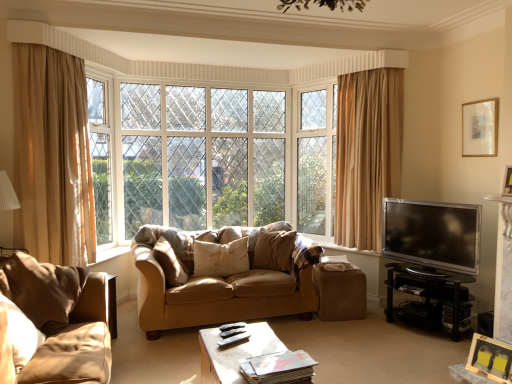
What do you see at coordinates (490, 358) in the screenshot? I see `wooden picture frame at lower right, the first picture frame from the left` at bounding box center [490, 358].

Describe the element at coordinates (340, 293) in the screenshot. I see `brown fabric ottoman at lower center` at that location.

Measure the distance between point (277, 253) and camera.

Point (277, 253) is 4.13 meters away from camera.

The image size is (512, 384). Describe the element at coordinates (220, 258) in the screenshot. I see `beige fabric pillow at center, the 2th pillow viewed from the left` at that location.

The image size is (512, 384). What are the coordinates of `white painted wood window frame at upper left` in the screenshot? It's located at (101, 153).

Locate an element on the screen. The width and height of the screenshot is (512, 384). wooden picture frame at upper right, the 2th picture frame positioned from the bottom is located at coordinates (507, 182).

The width and height of the screenshot is (512, 384). What are the coordinates of `wooden picture frame at lower right, the first picture frame from the left` in the screenshot? It's located at (490, 358).

Is suede couch at center, positioned as the first studio couch in right-to-left order, looking in the opposite direction of white painted wood window frame at upper left?

suede couch at center, positioned as the first studio couch in right-to-left order, is not turned away from white painted wood window frame at upper left.

Which is in front, point (161, 293) or point (108, 123)?

The point (161, 293) is closer.

Between suede couch at center, positioned as the first studio couch in right-to-left order, and white painted wood window frame at upper left, which one is positioned in front?

suede couch at center, positioned as the first studio couch in right-to-left order, is closer to the camera.

From a real-world perspective, is suede couch at center, which appears as the second studio couch when viewed from the front, under white painted wood window frame at upper left?

Yes, from a real-world perspective, suede couch at center, which appears as the second studio couch when viewed from the front, is below white painted wood window frame at upper left.

Can you confirm if white painted wood window frame at upper left is bigger than beige fabric pillow at center, the 2th pillow viewed from the left?

Yes.

Based on the photo, can you confirm if white painted wood window frame at upper left is taller than beige fabric pillow at center, the 2th pillow viewed from the left?

Yes, white painted wood window frame at upper left is taller than beige fabric pillow at center, the 2th pillow viewed from the left.

Do you think white painted wood window frame at upper left is within beige fabric pillow at center, the 2th pillow from the right, or outside of it?

white painted wood window frame at upper left is located beyond the bounds of beige fabric pillow at center, the 2th pillow from the right.

Between white painted wood window frame at upper left and beige fabric pillow at center, the 2th pillow from the right, which one has smaller width?

white painted wood window frame at upper left is thinner.

Is brown fabric ottoman at lower center facing away from suede-like beige sofa at lower left, which appears as the 1th studio couch when viewed from the front?

No, brown fabric ottoman at lower center is not facing away from suede-like beige sofa at lower left, which appears as the 1th studio couch when viewed from the front.

Where is `the 2nd studio couch above when counting from the brown fabric ottoman at lower center (from the image's perspective)`? Image resolution: width=512 pixels, height=384 pixels. the 2nd studio couch above when counting from the brown fabric ottoman at lower center (from the image's perspective) is located at coordinates (x=61, y=320).

Considering the relative sizes of brown fabric ottoman at lower center and suede-like beige sofa at lower left, marked as the second studio couch in a right-to-left arrangement, in the image provided, is brown fabric ottoman at lower center bigger than suede-like beige sofa at lower left, marked as the second studio couch in a right-to-left arrangement,?

No, brown fabric ottoman at lower center is not bigger than suede-like beige sofa at lower left, marked as the second studio couch in a right-to-left arrangement.

Does black glass tv stand at right, which appears as the 2th table when viewed from the left, turn towards wooden coffee table at center, which is counted as the 2th table, starting from the back?

Yes, black glass tv stand at right, which appears as the 2th table when viewed from the left, is aimed at wooden coffee table at center, which is counted as the 2th table, starting from the back.

Considering the relative sizes of black glass tv stand at right, which is the 2th table in front-to-back order, and wooden coffee table at center, arranged as the second table when viewed from the right, in the image provided, is black glass tv stand at right, which is the 2th table in front-to-back order, shorter than wooden coffee table at center, arranged as the second table when viewed from the right,?

In fact, black glass tv stand at right, which is the 2th table in front-to-back order, may be taller than wooden coffee table at center, arranged as the second table when viewed from the right.

Is black glass tv stand at right, the 1th table when ordered from back to front, smaller than wooden coffee table at center, which is counted as the first table, starting from the front?

Actually, black glass tv stand at right, the 1th table when ordered from back to front, might be larger than wooden coffee table at center, which is counted as the first table, starting from the front.

Visually, is black glass tv stand at right, which appears as the 2th table when viewed from the left, positioned to the left or to the right of wooden coffee table at center, arranged as the second table when viewed from the right?

black glass tv stand at right, which appears as the 2th table when viewed from the left, is to the right of wooden coffee table at center, arranged as the second table when viewed from the right.

From the picture: Is wooden picture frame at upper right, which is the 1th picture frame in back-to-front order, a part of wooden picture frame at upper right, which appears as the 2th picture frame when viewed from the right?

No.

From a real-world perspective, which is physically above, wooden picture frame at upper right, the 2th picture frame when ordered from left to right, or wooden picture frame at upper right, marked as the third picture frame in a left-to-right arrangement?

wooden picture frame at upper right, marked as the third picture frame in a left-to-right arrangement, from a real-world perspective.

Is wooden picture frame at upper right, the 2th picture frame when ordered from left to right, taller than wooden picture frame at upper right, marked as the third picture frame in a left-to-right arrangement?

In fact, wooden picture frame at upper right, the 2th picture frame when ordered from left to right, may be shorter than wooden picture frame at upper right, marked as the third picture frame in a left-to-right arrangement.

Does black glass tv stand at right, which is the 2th table in front-to-back order, turn towards wooden picture frame at lower right, the first picture frame from the left?

No, black glass tv stand at right, which is the 2th table in front-to-back order, does not turn towards wooden picture frame at lower right, the first picture frame from the left.

From the image's perspective, would you say black glass tv stand at right, which is the 2th table in front-to-back order, is shown under wooden picture frame at lower right, the first picture frame from the left?

Actually, black glass tv stand at right, which is the 2th table in front-to-back order, appears above wooden picture frame at lower right, the first picture frame from the left, in the image.

What are the coordinates of `the 1st picture frame to the right of the black glass tv stand at right, which is the 1th table from right to left, counting from the anchor's position` in the screenshot? It's located at (490, 358).

Is black glass tv stand at right, which appears as the 2th table when viewed from the left, far from wooden picture frame at lower right, acting as the 3th picture frame starting from the top?

They are positioned close to each other.

Is black glass tv stand at right, the 1th table when ordered from back to front, outside of wooden picture frame at upper right, the 1th picture frame in the right-to-left sequence?

black glass tv stand at right, the 1th table when ordered from back to front, lies outside wooden picture frame at upper right, the 1th picture frame in the right-to-left sequence,'s area.

Locate an element on the screen. the 1st table in front of the wooden picture frame at upper right, which is the third picture frame from bottom to top is located at coordinates 429,289.

Which is more to the right, black glass tv stand at right, which is the 2th table in front-to-back order, or wooden picture frame at upper right, the 1th picture frame in the right-to-left sequence?

wooden picture frame at upper right, the 1th picture frame in the right-to-left sequence, is more to the right.

From a real-world perspective, is black glass tv stand at right, which appears as the 2th table when viewed from the left, physically located above or below wooden picture frame at upper right, marked as the third picture frame in a left-to-right arrangement?

Clearly, from a real-world perspective, black glass tv stand at right, which appears as the 2th table when viewed from the left, is below wooden picture frame at upper right, marked as the third picture frame in a left-to-right arrangement.

At what (x,y) coordinates should I click in order to perform the action: click on window frame on the left of suede couch at center, the 1th studio couch positioned from the back. Please return your answer as a coordinate pair (x, y). This screenshot has width=512, height=384. Looking at the image, I should click on (101, 153).

Identify the location of window frame behind the beige fabric pillow at center, the 2th pillow from the right. This screenshot has height=384, width=512. (101, 153).

From the image, which object appears to be farther from clear glass window at center, beige fabric curtain at left or wooden picture frame at upper right, which is the third picture frame from bottom to top?

wooden picture frame at upper right, which is the third picture frame from bottom to top.

Considering their positions, is wooden coffee table at center, which is counted as the first table, starting from the front, positioned closer to beige fabric curtain at left than white painted wood window frame at upper left?

Among the two, white painted wood window frame at upper left is located nearer to beige fabric curtain at left.

Looking at the image, which one is located further to brown fabric ottoman at lower center, velvet beige pillow at center, positioned as the 3th pillow in left-to-right order, or suede couch at center, the 1th studio couch positioned from the back?

suede couch at center, the 1th studio couch positioned from the back, is positioned further to the anchor brown fabric ottoman at lower center.

Based on their spatial positions, is brown fabric ottoman at lower center or velvet beige pillow at center, the first pillow viewed from the right, closer to silver metallic tv at right?

brown fabric ottoman at lower center is positioned closer to the anchor silver metallic tv at right.

When comparing their distances from velvet beige pillow at center, positioned as the 3th pillow in left-to-right order, does wooden picture frame at upper right, which is the 1th picture frame in back-to-front order, or suede-like beige sofa at lower left, positioned as the 1th studio couch in left-to-right order, seem closer?

suede-like beige sofa at lower left, positioned as the 1th studio couch in left-to-right order.

Looking at the image, which one is located closer to suede-like beige pillow at center, which appears as the 3th pillow when viewed from the right, wooden picture frame at upper right, marked as the third picture frame in a left-to-right arrangement, or beige fabric curtain at left?

Among the two, beige fabric curtain at left is located nearer to suede-like beige pillow at center, which appears as the 3th pillow when viewed from the right.

Considering their positions, is wooden picture frame at lower right, acting as the 3th picture frame starting from the top, positioned further to suede-like beige pillow at center, the first pillow viewed from the left, than brown fabric ottoman at lower center?

wooden picture frame at lower right, acting as the 3th picture frame starting from the top.

Estimate the real-world distances between objects in this image. Which object is further from black glass tv stand at right, which is the 2th table in front-to-back order, wooden picture frame at upper right, the 2th picture frame in the top-to-bottom sequence, or brown fabric ottoman at lower center?

The object further to black glass tv stand at right, which is the 2th table in front-to-back order, is wooden picture frame at upper right, the 2th picture frame in the top-to-bottom sequence.

At what (x,y) coordinates should I click in order to perform the action: click on tree between white painted wood window frame at upper left and silver metallic tv at right in the horizontal direction. Please return your answer as a coordinate pair (x, y). The height and width of the screenshot is (384, 512). Looking at the image, I should click on (208, 157).

Locate an element on the screen. Image resolution: width=512 pixels, height=384 pixels. table between wooden coffee table at center, which is counted as the first table, starting from the left, and beige fabric pillow at center, the 2th pillow from the right, in the front-back direction is located at coordinates (429, 289).

This screenshot has width=512, height=384. In order to click on tree situated between beige fabric curtain at left and velvet beige pillow at center, the first pillow viewed from the right, from left to right in this screenshot , I will do `click(208, 157)`.

The height and width of the screenshot is (384, 512). What are the coordinates of `table between velvet beige pillow at center, the first pillow viewed from the right, and wooden picture frame at upper right, which is the 1th picture frame in back-to-front order, from left to right` in the screenshot? It's located at (429, 289).